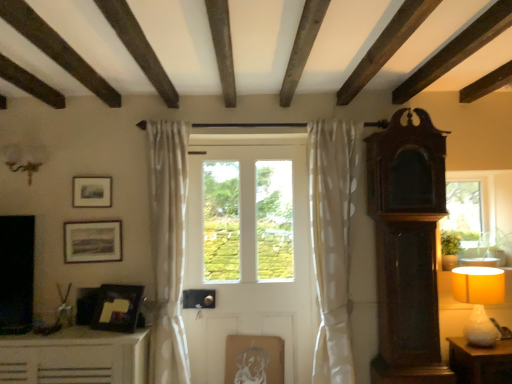
What do you see at coordinates (479, 300) in the screenshot? I see `matte yellow fabric lampshade at right` at bounding box center [479, 300].

How much space does white sheer curtain at center, acting as the 1th curtain starting from the right, occupy vertically?

1.88 meters.

This screenshot has height=384, width=512. I want to click on matte wooden picture frame at center, acting as the 4th picture frame starting from the top, so click(x=254, y=359).

This screenshot has height=384, width=512. I want to click on white matte door at center, so click(250, 254).

How much space does matte black picture frame at lower left, the 3th picture frame in the left-to-right sequence, occupy vertically?

It is 11.35 inches.

Find the location of `dark wood grandfather clock at right`. dark wood grandfather clock at right is located at coordinates (407, 248).

In order to face transparent glass window at center, should I rotate leftwards or rightwards?

Turn right approximately 26.504 degrees to face it.

The height and width of the screenshot is (384, 512). What do you see at coordinates (480, 213) in the screenshot?
I see `transparent glass window at center` at bounding box center [480, 213].

What is the approximate width of matte glass sconce at upper left?

It is 6.66 inches.

Where is `matte yellow fabric lampshade at right`? matte yellow fabric lampshade at right is located at coordinates (479, 300).

Is matte glass sconce at upper left located within white sheer curtain at center, acting as the 1th curtain starting from the right?

No, matte glass sconce at upper left is located outside of white sheer curtain at center, acting as the 1th curtain starting from the right.

From a real-world perspective, is white sheer curtain at center, arranged as the second curtain when viewed from the left, under matte glass sconce at upper left?

Yes, from a real-world perspective, white sheer curtain at center, arranged as the second curtain when viewed from the left, is under matte glass sconce at upper left.

From the image's perspective, does white sheer curtain at center, arranged as the second curtain when viewed from the left, appear higher than matte glass sconce at upper left?

No, from the image's perspective, white sheer curtain at center, arranged as the second curtain when viewed from the left, is not over matte glass sconce at upper left.

Does white sheer curtain at center, acting as the 1th curtain starting from the right, have a greater height compared to matte yellow fabric lampshade at right?

Yes.

Is white sheer curtain at center, arranged as the second curtain when viewed from the left, positioned beyond the bounds of matte yellow fabric lampshade at right?

Yes, white sheer curtain at center, arranged as the second curtain when viewed from the left, is located beyond the bounds of matte yellow fabric lampshade at right.

Between white sheer curtain at center, acting as the 1th curtain starting from the right, and matte yellow fabric lampshade at right, which one has smaller width?

matte yellow fabric lampshade at right is thinner.

Would you consider matte glass sconce at upper left to be distant from matte yellow fabric lampshade at right?

matte glass sconce at upper left is far away from matte yellow fabric lampshade at right.

Do you think matte glass sconce at upper left is within matte yellow fabric lampshade at right, or outside of it?

The correct answer is: outside.

Which object is thinner, matte glass sconce at upper left or matte yellow fabric lampshade at right?

With smaller width is matte glass sconce at upper left.

Is point (322, 147) closer or farther from the camera than point (180, 263)?

Point (322, 147) appears to be closer to the viewer than point (180, 263).

Based on the photo, does white sheer curtain at center, acting as the 1th curtain starting from the right, have a lesser height compared to white sheer curtain at left, which is the first curtain in left-to-right order?

Incorrect, the height of white sheer curtain at center, acting as the 1th curtain starting from the right, does not fall short of that of white sheer curtain at left, which is the first curtain in left-to-right order.

Looking at this image, are white sheer curtain at center, arranged as the second curtain when viewed from the left, and white sheer curtain at left, which is the first curtain in left-to-right order, located far from each other?

white sheer curtain at center, arranged as the second curtain when viewed from the left, is far away from white sheer curtain at left, which is the first curtain in left-to-right order.

Is white sheer curtain at center, acting as the 1th curtain starting from the right, bigger than white sheer curtain at left, which is the first curtain in left-to-right order?

Indeed, white sheer curtain at center, acting as the 1th curtain starting from the right, has a larger size compared to white sheer curtain at left, which is the first curtain in left-to-right order.

Is white sheer curtain at left, arranged as the second curtain when viewed from the right, directly adjacent to transparent glass window at center?

No, white sheer curtain at left, arranged as the second curtain when viewed from the right, is not making contact with transparent glass window at center.

Would you say transparent glass window at center is part of white sheer curtain at left, which is the first curtain in left-to-right order,'s contents?

No.

From the picture: Considering the relative positions of white sheer curtain at left, which is the first curtain in left-to-right order, and transparent glass window at center in the image provided, is white sheer curtain at left, which is the first curtain in left-to-right order, to the left or to the right of transparent glass window at center?

From the image, it's evident that white sheer curtain at left, which is the first curtain in left-to-right order, is to the left of transparent glass window at center.

Is white sheer curtain at left, arranged as the second curtain when viewed from the right, turned away from transparent glass window at center?

No, white sheer curtain at left, arranged as the second curtain when viewed from the right, is not facing away from transparent glass window at center.

Considering the sizes of matte wooden picture frame at upper left, the second picture frame from the front, and white sheer curtain at left, which is the first curtain in left-to-right order, in the image, is matte wooden picture frame at upper left, the second picture frame from the front, taller or shorter than white sheer curtain at left, which is the first curtain in left-to-right order,?

In the image, matte wooden picture frame at upper left, the second picture frame from the front, appears to be shorter than white sheer curtain at left, which is the first curtain in left-to-right order.

Is matte wooden picture frame at upper left, the 2th picture frame positioned from the top, oriented away from white sheer curtain at left, which is the first curtain in left-to-right order?

That's not correct — matte wooden picture frame at upper left, the 2th picture frame positioned from the top, is not looking away from white sheer curtain at left, which is the first curtain in left-to-right order.

Between matte wooden picture frame at upper left, which is the second picture frame in left-to-right order, and white sheer curtain at left, which is the first curtain in left-to-right order, which one has smaller size?

With smaller size is matte wooden picture frame at upper left, which is the second picture frame in left-to-right order.

Is the surface of white sheer curtain at left, which is the first curtain in left-to-right order, in direct contact with matte black picture frame at upper left, positioned as the fourth picture frame in bottom-to-top order?

They are not placed beside each other.

How distant is white sheer curtain at left, which is the first curtain in left-to-right order, from matte black picture frame at upper left, marked as the first picture frame in a left-to-right arrangement?

white sheer curtain at left, which is the first curtain in left-to-right order, is 60.03 centimeters away from matte black picture frame at upper left, marked as the first picture frame in a left-to-right arrangement.

Relative to matte black picture frame at upper left, the 2th picture frame in the back-to-front sequence, is white sheer curtain at left, arranged as the second curtain when viewed from the right, in front or behind?

white sheer curtain at left, arranged as the second curtain when viewed from the right, is positioned closer to the viewer than matte black picture frame at upper left, the 2th picture frame in the back-to-front sequence.

Is white sheer curtain at left, which is the first curtain in left-to-right order, shorter than matte black picture frame at upper left, positioned as the fourth picture frame in bottom-to-top order?

No, white sheer curtain at left, which is the first curtain in left-to-right order, is not shorter than matte black picture frame at upper left, positioned as the fourth picture frame in bottom-to-top order.

At what (x,y) coordinates should I click in order to perform the action: click on lamp that is above the white sheer curtain at center, arranged as the second curtain when viewed from the left (from a real-world perspective). Please return your answer as a coordinate pair (x, y). The height and width of the screenshot is (384, 512). Looking at the image, I should click on (26, 159).

Where is `curtain that is the 1st one when counting upward from the matte yellow fabric lampshade at right (from the image's perspective)`? curtain that is the 1st one when counting upward from the matte yellow fabric lampshade at right (from the image's perspective) is located at coordinates point(332,240).

From the image, which object appears to be farther from matte black picture frame at lower left, which appears as the 3th picture frame when viewed from the top, matte glass sconce at upper left or white matte door at center?

Based on the image, matte glass sconce at upper left appears to be further to matte black picture frame at lower left, which appears as the 3th picture frame when viewed from the top.

Which object lies further to the anchor point matte black picture frame at upper left, which is the fourth picture frame from right to left, matte wooden picture frame at center, the first picture frame in the right-to-left sequence, or matte wooden picture frame at upper left, the 2th picture frame positioned from the top?

matte wooden picture frame at center, the first picture frame in the right-to-left sequence, is further to matte black picture frame at upper left, which is the fourth picture frame from right to left.

Considering their positions, is transparent glass window at center positioned closer to matte black picture frame at upper left, positioned as the fourth picture frame in bottom-to-top order, than matte black picture frame at lower left, which appears as the 3th picture frame when viewed from the top?

matte black picture frame at lower left, which appears as the 3th picture frame when viewed from the top, is closer to matte black picture frame at upper left, positioned as the fourth picture frame in bottom-to-top order.

Considering their positions, is white matte door at center positioned further to dark wood grandfather clock at right than matte glass sconce at upper left?

matte glass sconce at upper left.

From the image, which object appears to be nearer to white matte door at center, white sheer curtain at left, arranged as the second curtain when viewed from the right, or dark wood grandfather clock at right?

white sheer curtain at left, arranged as the second curtain when viewed from the right.

Which object lies nearer to the anchor point transparent glass window at center, dark wood grandfather clock at right or matte yellow fabric lampshade at right?

matte yellow fabric lampshade at right.

From the image, which object appears to be nearer to white sheer curtain at left, arranged as the second curtain when viewed from the right, matte wooden picture frame at upper left, the 2th picture frame positioned from the top, or dark wood grandfather clock at right?

matte wooden picture frame at upper left, the 2th picture frame positioned from the top, is positioned closer to the anchor white sheer curtain at left, arranged as the second curtain when viewed from the right.

From the image, which object appears to be nearer to dark wood grandfather clock at right, white matte door at center or wooden table at right?

Based on the image, wooden table at right appears to be nearer to dark wood grandfather clock at right.

The width and height of the screenshot is (512, 384). Find the location of `table between white matte door at center and transparent glass window at center in the horizontal direction`. table between white matte door at center and transparent glass window at center in the horizontal direction is located at coordinates (480, 362).

You are a GUI agent. You are given a task and a screenshot of the screen. Output one action in this format:
    pyautogui.click(x=<x>, y=<y>)
    Task: Click on the curtain between white matte door at center and matte yellow fabric lampshade at right from left to right
    The width and height of the screenshot is (512, 384).
    Given the screenshot: What is the action you would take?
    pyautogui.click(x=332, y=240)

Image resolution: width=512 pixels, height=384 pixels. What are the coordinates of `table lamp between matte glass sconce at upper left and wooden table at right from left to right` in the screenshot? It's located at (479, 300).

Where is `curtain between white matte door at center and wooden table at right in the horizontal direction`? curtain between white matte door at center and wooden table at right in the horizontal direction is located at coordinates (332, 240).